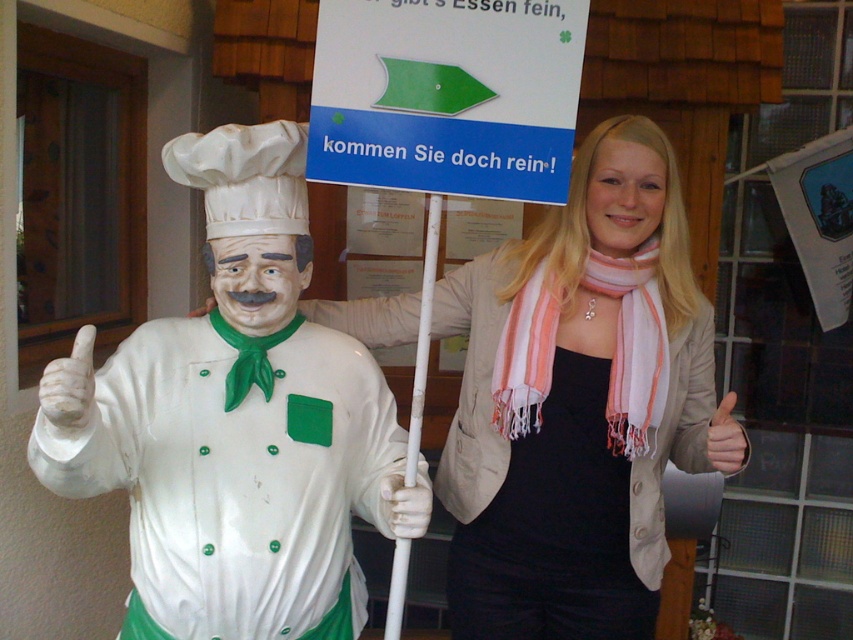
Please provide the 2D coordinates of the matte beige jacket at center in the image. The coordinates should be in the format of a point with two decimal places, such as point x, y. The answer should be concise and only include the coordinates.

The coordinates are point (579, 403).

You are a delivery person with a box that is 1.5 meters long. You need to place the box between the matte beige jacket at center and the chef statue. Will the box fit between them?

The distance between the matte beige jacket at center and the chef statue is 1.49 meters, which is shorter than the box length of 1.5 meters. Therefore, the box will not fit between them.

You are a tour guide leading a group near the white glossy statue at left and the white plastic pole at center. You want to place a 10 inch wide information board between them. Is there enough space?

The distance between the white glossy statue at left and the white plastic pole at center is 9.27 inches, which is less than the 10 inch width of the board. Therefore, there isn not enough space to place the board between them.